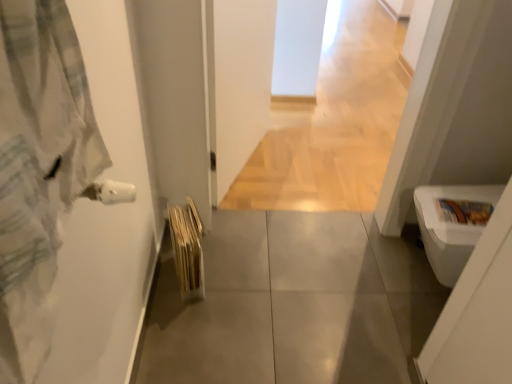
Locate an element on the screen. Image resolution: width=512 pixels, height=384 pixels. free space in front of beige textured bath towel at lower left is located at coordinates (185, 315).